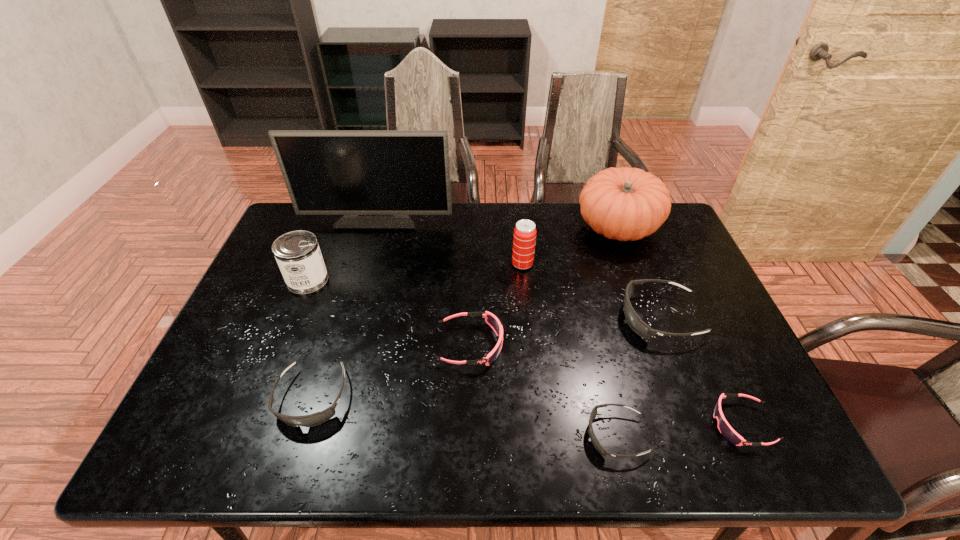
At what (x,y) coordinates should I click in order to perform the action: click on the leftmost goggles. Please return your answer as a coordinate pair (x, y). Looking at the image, I should click on (317, 418).

This screenshot has height=540, width=960. I want to click on the leftmost black goggles, so click(317, 418).

Locate an element on the screen. The width and height of the screenshot is (960, 540). the nearer pink goggles is located at coordinates (726, 430).

You are a GUI agent. You are given a task and a screenshot of the screen. Output one action in this format:
    pyautogui.click(x=<x>, y=<y>)
    Task: Click on the smaller pink goggles
    This screenshot has height=540, width=960.
    Given the screenshot: What is the action you would take?
    pyautogui.click(x=726, y=430)

Image resolution: width=960 pixels, height=540 pixels. What are the coordinates of `the second black goggles from right to left` in the screenshot? It's located at (596, 443).

Locate an element on the screen. the third goggles from right to left is located at coordinates (596, 443).

Image resolution: width=960 pixels, height=540 pixels. What are the coordinates of `free spot located 0.190m on the screen side of the black monitor` in the screenshot? It's located at (364, 267).

Where is `vacant space situated 0.330m on the left of the pumpkin`? The image size is (960, 540). vacant space situated 0.330m on the left of the pumpkin is located at coordinates (476, 228).

Where is `vacant region located 0.160m on the right of the soda can`? Image resolution: width=960 pixels, height=540 pixels. vacant region located 0.160m on the right of the soda can is located at coordinates (586, 264).

Find the location of a particular element. Image resolution: width=960 pixels, height=540 pixels. vacant region located 0.340m on the back of the can is located at coordinates (339, 202).